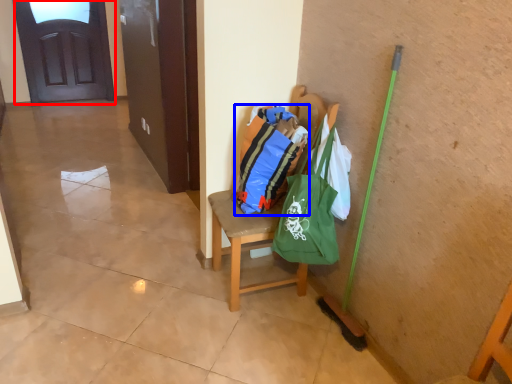
Question: Which of the following is the closest to the observer, door (highlighted by a red box) or shopping bag (highlighted by a blue box)?

Choices:
 (A) door
 (B) shopping bag

Answer: (B)